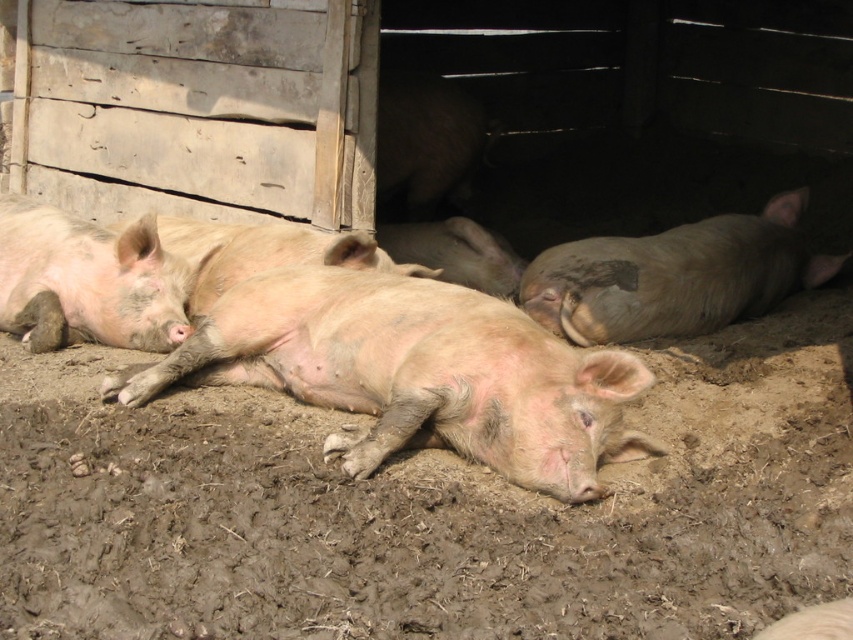
Question: Which of the following is the farthest from the observer?

Choices:
 (A) (416, 348)
 (B) (566, 266)
 (C) (99, 269)

Answer: (B)

Question: In this image, where is pink muddy pig at center located relative to pink matte/skinny pig at left?

Choices:
 (A) below
 (B) above

Answer: (A)

Question: Is pink muddy pig at center smaller than pink matte/skinny pig at left?

Choices:
 (A) no
 (B) yes

Answer: (A)

Question: Which object is positioned closest to the pink matte/skinny pig at left?

Choices:
 (A) gray matte pig at right
 (B) pink muddy pig at center

Answer: (B)

Question: Is gray matte pig at right below pink matte/skinny pig at left?

Choices:
 (A) no
 (B) yes

Answer: (B)

Question: Which object is farther from the camera taking this photo?

Choices:
 (A) pink muddy pig at center
 (B) gray matte pig at right
 (C) pink matte/skinny pig at left

Answer: (B)